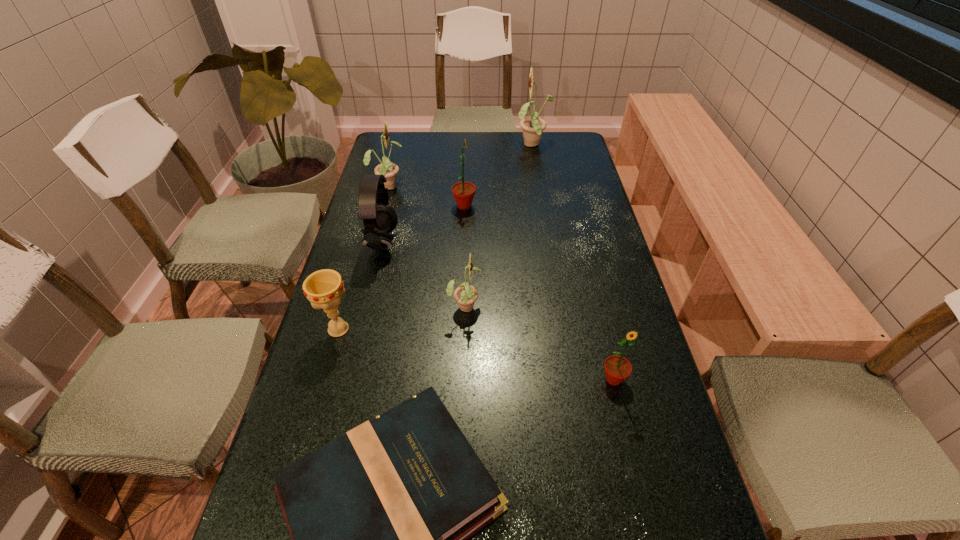
The image size is (960, 540). Find the location of `the nearest sunflower`. the nearest sunflower is located at coordinates pyautogui.click(x=617, y=368).

Where is `the right green sunflower`? the right green sunflower is located at coordinates (617, 368).

Locate an element on the screen. This screenshot has height=540, width=960. chalice is located at coordinates (324, 288).

Locate an element on the screen. Image resolution: width=960 pixels, height=540 pixels. vacant region located 0.190m on the front-facing side of the farthest sunflower is located at coordinates (468, 145).

Identify the location of free location located on the front-facing side of the farthest sunflower. The width and height of the screenshot is (960, 540). tap(424, 145).

Image resolution: width=960 pixels, height=540 pixels. In order to click on vacant space located 0.210m on the front-facing side of the farthest sunflower in this screenshot , I will do `click(462, 145)`.

I want to click on vacant space situated on the front-facing side of the second biggest yellow sunflower, so click(462, 185).

Image resolution: width=960 pixels, height=540 pixels. I want to click on vacant space located on the face of the farther green sunflower, so click(576, 206).

The width and height of the screenshot is (960, 540). I want to click on vacant area situated 0.050m on the ear cups of the black earphone, so click(414, 243).

Identify the location of vacant region located on the front-facing side of the second yellow sunflower from left to right. The width and height of the screenshot is (960, 540). (532, 306).